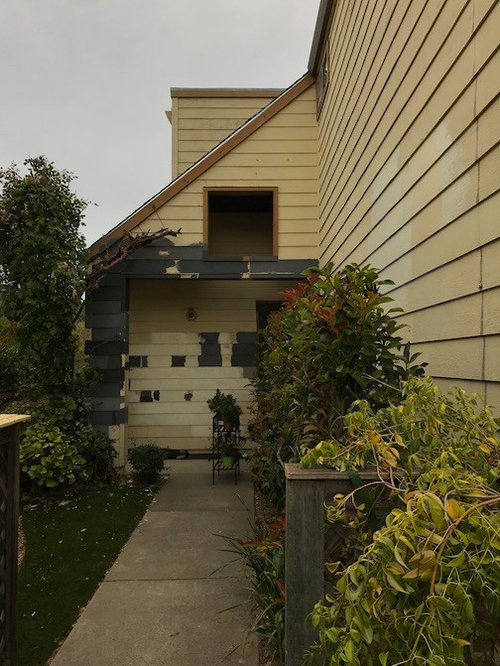
Locate an element on the screen. Image resolution: width=500 pixels, height=666 pixels. plant pot is located at coordinates (226, 463), (230, 427).